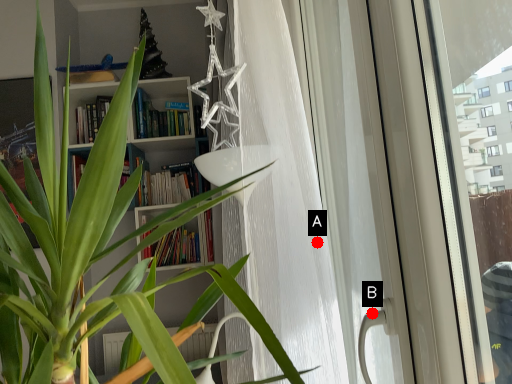
Question: Two points are circled on the image, labeled by A and B beside each circle. Which of the following is the closest to the observer?

Choices:
 (A) A is closer
 (B) B is closer

Answer: (B)